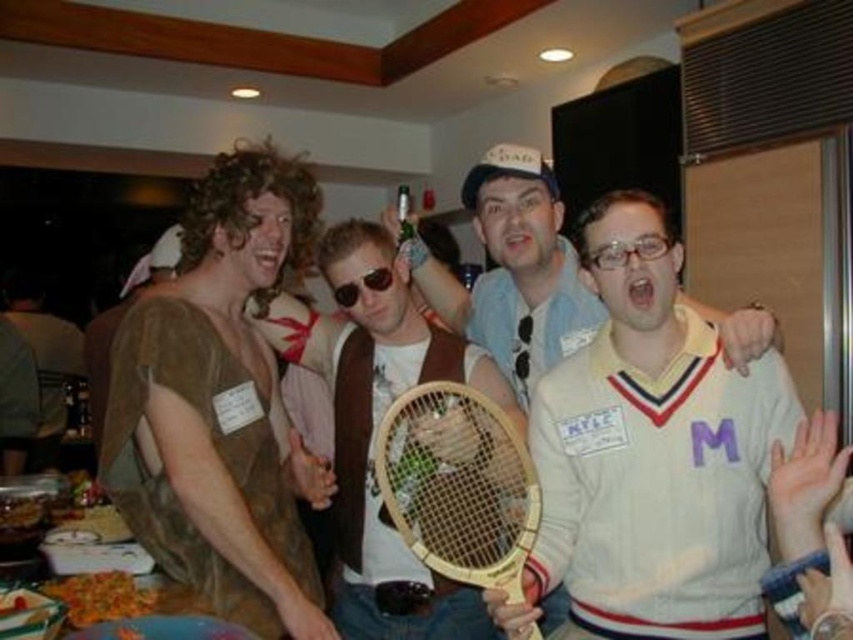
Does white jersey at center come in front of wooden tennis racket at center?

Yes.

Can you confirm if white jersey at center is positioned to the right of wooden tennis racket at center?

Correct, you'll find white jersey at center to the right of wooden tennis racket at center.

Find the location of `white jersey at center`. white jersey at center is located at coordinates (665, 464).

The height and width of the screenshot is (640, 853). What are the coordinates of `wooden tennis racket at center` in the screenshot? It's located at tap(372, 435).

Does point (490, 387) come farther from viewer compared to point (473, 557)?

Yes, it is behind point (473, 557).

Locate an element on the screen. wooden tennis racket at center is located at coordinates (372, 435).

Can you confirm if wooden racket at center is shorter than clear plastic glasses at center?

In fact, wooden racket at center may be taller than clear plastic glasses at center.

Does wooden racket at center have a greater width compared to clear plastic glasses at center?

Yes, wooden racket at center is wider than clear plastic glasses at center.

Find the location of a particular element. wooden racket at center is located at coordinates (457, 484).